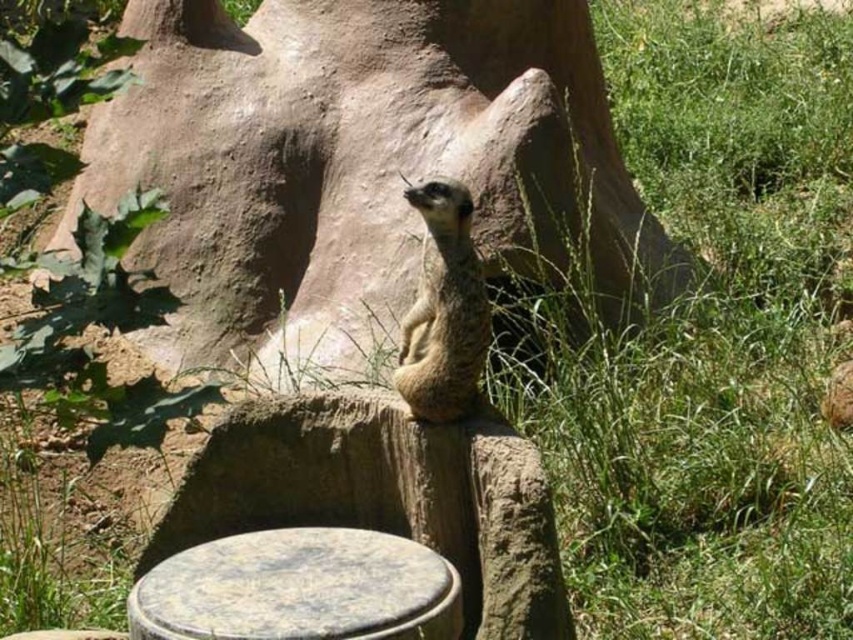
Does speckled stone stool at center have a greater width compared to furry brown meerkat at center?

Yes, speckled stone stool at center is wider than furry brown meerkat at center.

Is speckled stone stool at center taller than furry brown meerkat at center?

No.

The width and height of the screenshot is (853, 640). What do you see at coordinates (299, 588) in the screenshot?
I see `speckled stone stool at center` at bounding box center [299, 588].

Image resolution: width=853 pixels, height=640 pixels. I want to click on speckled stone stool at center, so click(299, 588).